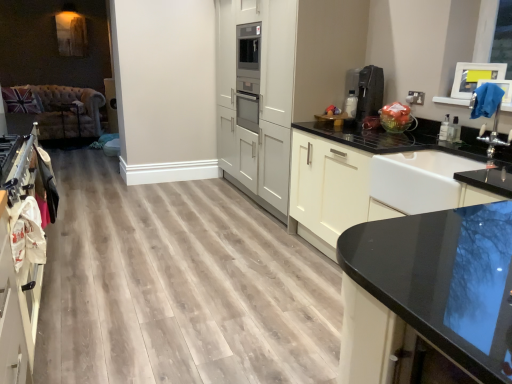
Question: Is white glossy cabinet at center, the 1th cabinetry in the right-to-left sequence, with white matte cabinetry at center, arranged as the 2th cabinetry when viewed from the right?

Choices:
 (A) no
 (B) yes

Answer: (A)

Question: Is white glossy cabinet at center, the 1th cabinetry in the right-to-left sequence, facing away from white matte cabinetry at center, placed as the 2th cabinetry when sorted from left to right?

Choices:
 (A) no
 (B) yes

Answer: (A)

Question: Does white glossy cabinet at center, the third cabinetry positioned from the left, lie in front of white matte cabinetry at center, arranged as the 2th cabinetry when viewed from the right?

Choices:
 (A) no
 (B) yes

Answer: (B)

Question: From the image's perspective, is white glossy cabinet at center, the 1th cabinetry in the right-to-left sequence, on white matte cabinetry at center, placed as the 2th cabinetry when sorted from left to right?

Choices:
 (A) yes
 (B) no

Answer: (B)

Question: Considering the relative sizes of white glossy cabinet at center, the third cabinetry positioned from the left, and white matte cabinetry at center, arranged as the 2th cabinetry when viewed from the right, in the image provided, is white glossy cabinet at center, the third cabinetry positioned from the left, taller than white matte cabinetry at center, arranged as the 2th cabinetry when viewed from the right,?

Choices:
 (A) yes
 (B) no

Answer: (B)

Question: Is white glossy cabinet at center, the third cabinetry positioned from the left, spatially inside black plastic coffee machine at upper right, or outside of it?

Choices:
 (A) outside
 (B) inside

Answer: (A)

Question: Relative to black plastic coffee machine at upper right, is white glossy cabinet at center, the 1th cabinetry in the right-to-left sequence, in front or behind?

Choices:
 (A) behind
 (B) front

Answer: (B)

Question: Is point (392, 147) positioned closer to the camera than point (376, 114)?

Choices:
 (A) closer
 (B) farther

Answer: (A)

Question: In terms of height, does white glossy cabinet at center, the third cabinetry positioned from the left, look taller or shorter compared to black plastic coffee machine at upper right?

Choices:
 (A) tall
 (B) short

Answer: (A)

Question: From a real-world perspective, is white matte cabinetry at center, placed as the 2th cabinetry when sorted from left to right, physically located above or below white glossy sink at right?

Choices:
 (A) below
 (B) above

Answer: (B)

Question: Considering the positions of white matte cabinetry at center, arranged as the 2th cabinetry when viewed from the right, and white glossy sink at right in the image, is white matte cabinetry at center, arranged as the 2th cabinetry when viewed from the right, taller or shorter than white glossy sink at right?

Choices:
 (A) tall
 (B) short

Answer: (A)

Question: From the image's perspective, relative to white glossy sink at right, is white matte cabinetry at center, arranged as the 2th cabinetry when viewed from the right, above or below?

Choices:
 (A) below
 (B) above

Answer: (B)

Question: Considering their positions, is white matte cabinetry at center, placed as the 2th cabinetry when sorted from left to right, located in front of or behind white glossy sink at right?

Choices:
 (A) behind
 (B) front

Answer: (A)

Question: Is white matte cabinet at left, the third cabinetry positioned from the right, taller or shorter than white glossy cabinet at center, the third cabinetry positioned from the left?

Choices:
 (A) tall
 (B) short

Answer: (B)

Question: Looking at the image, does white matte cabinet at left, which is the 1th cabinetry from left to right, seem bigger or smaller compared to white glossy cabinet at center, the 1th cabinetry in the right-to-left sequence?

Choices:
 (A) big
 (B) small

Answer: (B)